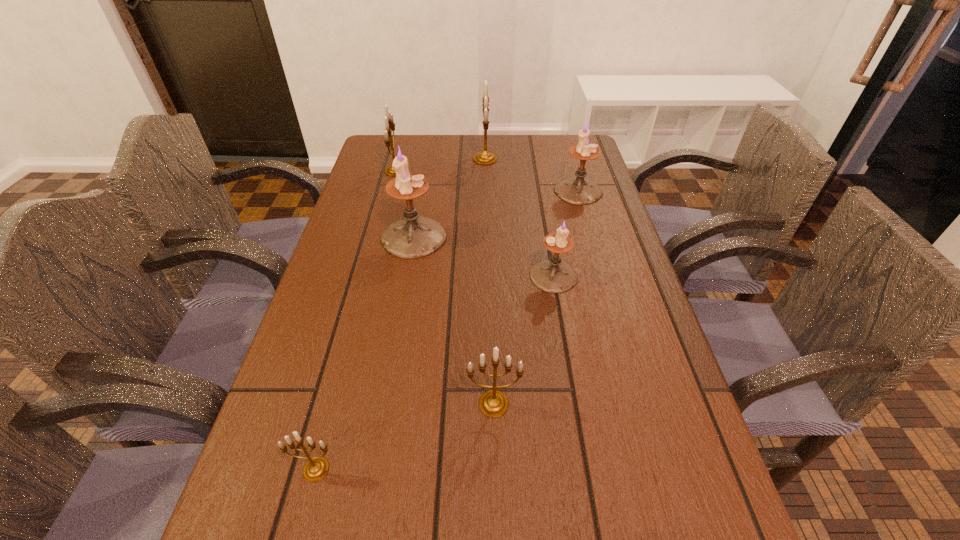
Locate an element on the screen. The image size is (960, 540). vacant area at the left edge is located at coordinates (337, 289).

Locate an element on the screen. This screenshot has width=960, height=540. free space at the right edge is located at coordinates (615, 234).

The image size is (960, 540). What are the coordinates of `vacant space at the far right corner of the desktop` in the screenshot? It's located at (550, 155).

You are a GUI agent. You are given a task and a screenshot of the screen. Output one action in this format:
    pyautogui.click(x=<x>, y=<y>)
    Task: Click on the empty space between the nearest object and the fourth nearest object
    
    Given the screenshot: What is the action you would take?
    pyautogui.click(x=365, y=353)

At what (x,y) coordinates should I click in order to perform the action: click on vacant area that lies between the biggest gold candelabrum and the smallest purple candle holder. Please return your answer as a coordinate pair (x, y). The height and width of the screenshot is (540, 960). Looking at the image, I should click on (519, 217).

You are a GUI agent. You are given a task and a screenshot of the screen. Output one action in this format:
    pyautogui.click(x=<x>, y=<y>)
    Task: Click on the vacant area that lies between the sixth farthest candelabrum and the third smallest gold candelabrum
    The height and width of the screenshot is (540, 960).
    Given the screenshot: What is the action you would take?
    pyautogui.click(x=444, y=287)

This screenshot has height=540, width=960. I want to click on blank region between the nearest gold candelabrum and the biggest purple candle holder, so click(x=365, y=353).

The width and height of the screenshot is (960, 540). What are the coordinates of `vacant area that lies between the third smallest gold candelabrum and the second smallest purple candle holder` in the screenshot? It's located at (487, 181).

Image resolution: width=960 pixels, height=540 pixels. Find the location of `object that stands as the sixth closest to the third biggest gold candelabrum`. object that stands as the sixth closest to the third biggest gold candelabrum is located at coordinates (483, 158).

Identify which object is located as the second nearest to the biggest gold candelabrum. Please provide its 2D coordinates. Your answer should be formatted as a tuple, i.e. [(x, y)], where the tuple contains the x and y coordinates of a point satisfying the conditions above.

[(389, 122)]